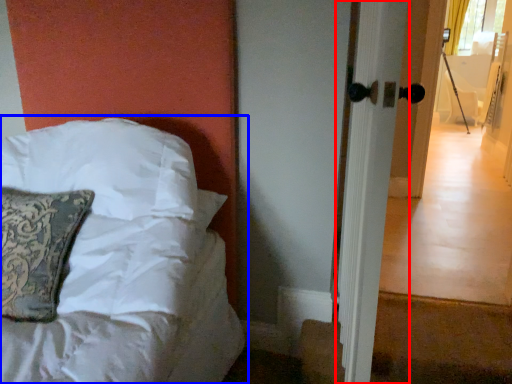
Question: Among these objects, which one is farthest to the camera, screen door (highlighted by a red box) or bed (highlighted by a blue box)?

Choices:
 (A) screen door
 (B) bed

Answer: (B)